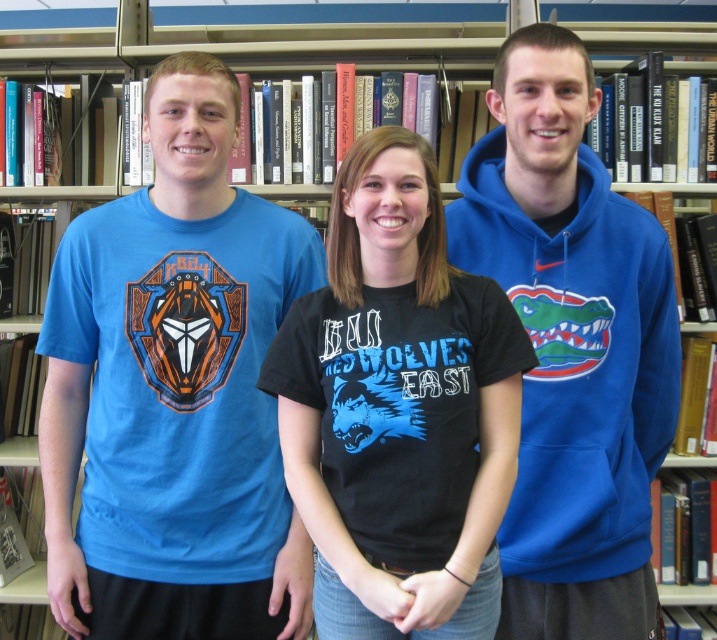
Question: Which point is closer to the camera?

Choices:
 (A) black matte t-shirt at center
 (B) matte blue t-shirt at center

Answer: (A)

Question: Which object appears closest to the camera in this image?

Choices:
 (A) blue fleece hoodie at center
 (B) black matte t-shirt at center
 (C) matte blue t-shirt at center

Answer: (B)

Question: Does black matte t-shirt at center have a smaller size compared to blue fleece hoodie at center?

Choices:
 (A) no
 (B) yes

Answer: (B)

Question: From the image, what is the correct spatial relationship of black matte t-shirt at center in relation to blue fleece hoodie at center?

Choices:
 (A) right
 (B) left

Answer: (B)

Question: Does matte blue t-shirt at center appear under blue fleece hoodie at center?

Choices:
 (A) no
 (B) yes

Answer: (B)

Question: Which of the following is the closest to the observer?

Choices:
 (A) blue fleece hoodie at center
 (B) black matte t-shirt at center
 (C) matte blue t-shirt at center

Answer: (B)